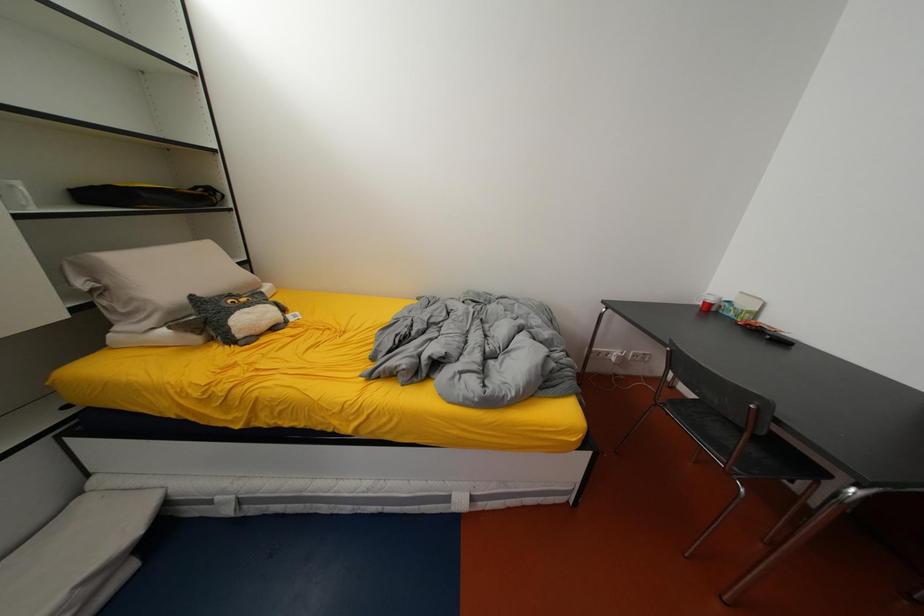
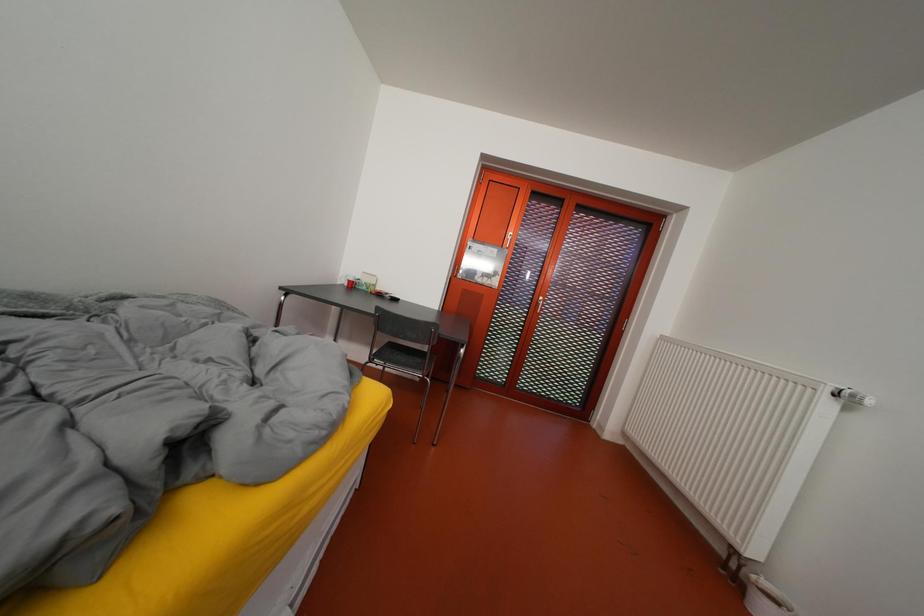
Question: The first image is from the beginning of the video and the second image is from the end. How did the camera likely rotate when shooting the video?

Choices:
 (A) Left
 (B) Right
 (C) Up
 (D) Down

Answer: (B)